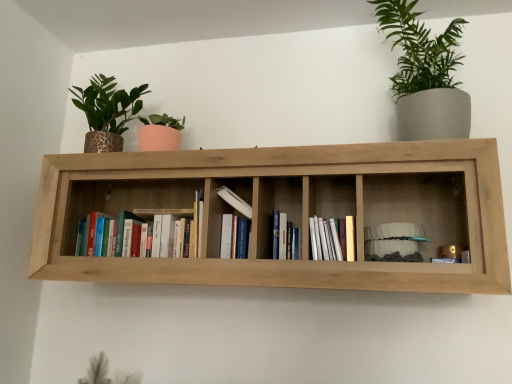
Question: From the image's perspective, is natural wood shelf at center above or below hardcover book at center, which is the 3th book in left-to-right order?

Choices:
 (A) above
 (B) below

Answer: (A)

Question: In the image, is natural wood shelf at center on the left side or the right side of hardcover book at center, which is the 3th book in left-to-right order?

Choices:
 (A) left
 (B) right

Answer: (A)

Question: Estimate the real-world distances between objects in this image. Which object is closer to the white matte book at center, the 2th book viewed from the left?

Choices:
 (A) green matte plant at upper right
 (B) white matte stack of plates at right, marked as the 1th book in a right-to-left arrangement
 (C) hardcover book at center, which is the 3th book in left-to-right order
 (D) hardcover books at center, which ranks as the fifth book in right-to-left order
 (E) white paper at center, which ranks as the second book in right-to-left order

Answer: (C)

Question: Estimate the real-world distances between objects in this image. Which object is farther from the natural wood shelf at center?

Choices:
 (A) green matte plant at upper right
 (B) hardcover books at center, the first book positioned from the left
 (C) white paper at center, which ranks as the second book in right-to-left order
 (D) hardcover book at center, marked as the third book in a right-to-left arrangement
 (E) white matte book at center, which appears as the 4th book when viewed from the right

Answer: (A)